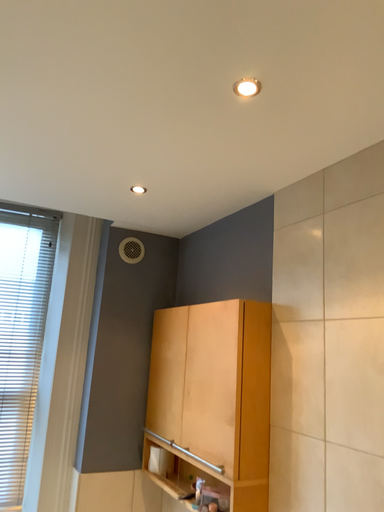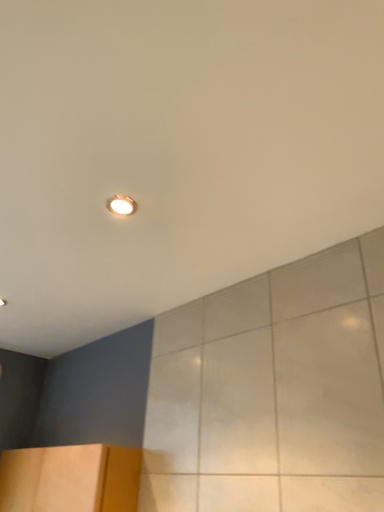
Question: How did the camera likely rotate when shooting the video?

Choices:
 (A) rotated left
 (B) rotated right

Answer: (B)